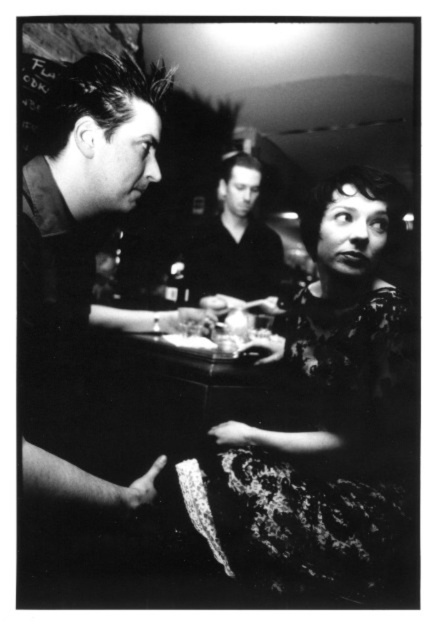
Between point (271, 349) and point (197, 339), which one is positioned in front?

Positioned in front is point (271, 349).

The height and width of the screenshot is (640, 438). What do you see at coordinates (233, 337) in the screenshot?
I see `smooth plastic plate at center` at bounding box center [233, 337].

The height and width of the screenshot is (640, 438). What are the coordinates of `smooth plastic plate at center` in the screenshot? It's located at pyautogui.click(x=233, y=337).

Is shiny black shirt at left below smooth plastic plate at center?

No.

Is shiny black shirt at left to the left of smooth plastic plate at center from the viewer's perspective?

Indeed, shiny black shirt at left is positioned on the left side of smooth plastic plate at center.

Does point (141, 477) come farther from viewer compared to point (282, 348)?

That is False.

Identify the location of shiny black shirt at left. The width and height of the screenshot is (438, 640). (89, 189).

Which is more to the right, shiny black shirt at left or smooth black shirt at center?

From the viewer's perspective, smooth black shirt at center appears more on the right side.

Does shiny black shirt at left have a lesser height compared to smooth black shirt at center?

No.

Which is behind, point (148, 328) or point (243, 211)?

The point (148, 328) is more distant.

Identify the location of shiny black shirt at left. (89, 189).